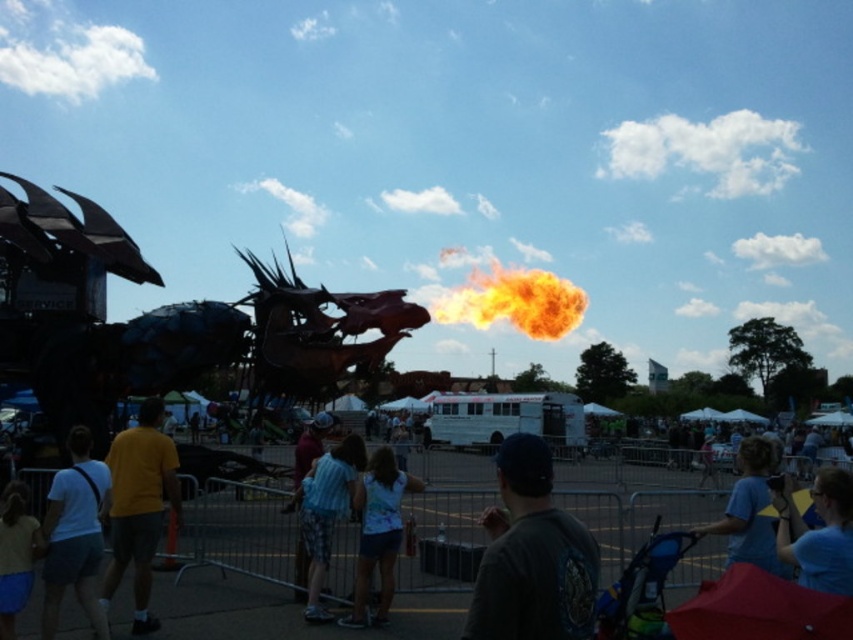
Question: Is dark gray fabric shirt at center above blue shirt at center?

Choices:
 (A) no
 (B) yes

Answer: (B)

Question: Among these points, which one is nearest to the camera?

Choices:
 (A) (556, 540)
 (B) (364, 589)

Answer: (A)

Question: Does dark gray fabric shirt at center have a greater width compared to blue cotton shirt at center?

Choices:
 (A) no
 (B) yes

Answer: (A)

Question: Is dark gray fabric shirt at center closer to camera compared to white cotton shirt at center?

Choices:
 (A) yes
 (B) no

Answer: (A)

Question: Which point is closer to the camera taking this photo?

Choices:
 (A) (381, 449)
 (B) (831, 532)
 (C) (68, 474)
 (D) (318, 496)

Answer: (B)

Question: Which object is closer to the camera taking this photo?

Choices:
 (A) white cotton shirt at lower left
 (B) yellow t-shirt at center
 (C) white cotton shirt at center
 (D) flame at center

Answer: (A)